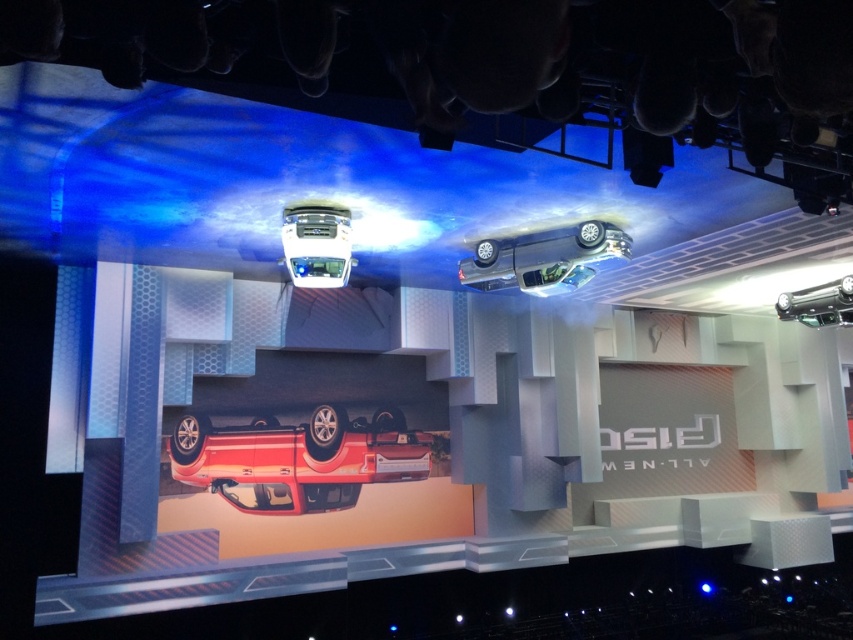
You are an event planner standing at the back of the stage. You need to ensure that both the satin silver car at upper center and the shiny silver car at center are visible to the audience. Based on their positions, which car is placed higher up on the stage?

The satin silver car at upper center is positioned above the shiny silver car at center, so it is placed higher up on the stage.

You are an event planner setting up the stage for a car exhibition. You need to ensure that the shiny red car at center is visible to the audience without obstruction. Is the satin silver car at upper center blocking its view?

The shiny red car at center is below the satin silver car at upper center, so the satin silver car may block the view of the red car depending on the angle and height of the audience seats. To ensure visibility, adjust the positioning or angle of the satin silver car at upper center.